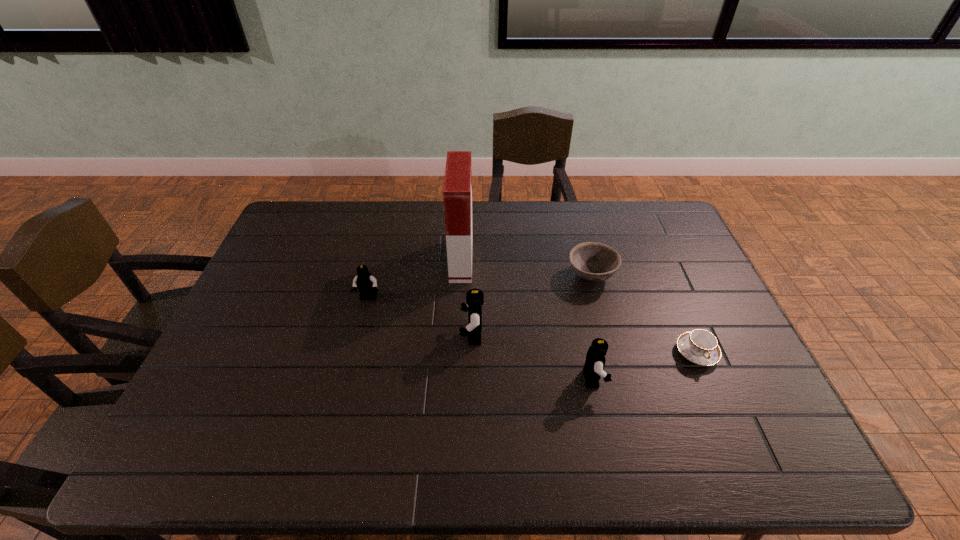
At what (x,y) coordinates should I click in order to perform the action: click on vacant region at the far edge of the desktop. Please return your answer as a coordinate pair (x, y). Image resolution: width=960 pixels, height=540 pixels. Looking at the image, I should click on (427, 206).

This screenshot has height=540, width=960. In order to click on vacant space at the left edge of the desktop in this screenshot , I will do `click(289, 257)`.

This screenshot has height=540, width=960. I want to click on vacant space at the right edge, so tap(678, 244).

The width and height of the screenshot is (960, 540). What are the coordinates of `blank space at the far left corner of the desktop` in the screenshot? It's located at (304, 223).

The height and width of the screenshot is (540, 960). Identify the location of vacant space at the near left corner. (236, 395).

Locate an element on the screen. This screenshot has width=960, height=540. vacant space at the far right corner of the desktop is located at coordinates (634, 217).

Where is `vacant space in between the second Lego from right to left and the third tallest object`? This screenshot has width=960, height=540. vacant space in between the second Lego from right to left and the third tallest object is located at coordinates (533, 357).

The width and height of the screenshot is (960, 540). I want to click on vacant area between the fifth tallest object and the rightmost Lego, so click(x=592, y=327).

I want to click on free space between the teacup and the fourth tallest object, so click(533, 326).

The width and height of the screenshot is (960, 540). Find the location of `vacant area between the shortest object and the nearest Lego`. vacant area between the shortest object and the nearest Lego is located at coordinates (645, 366).